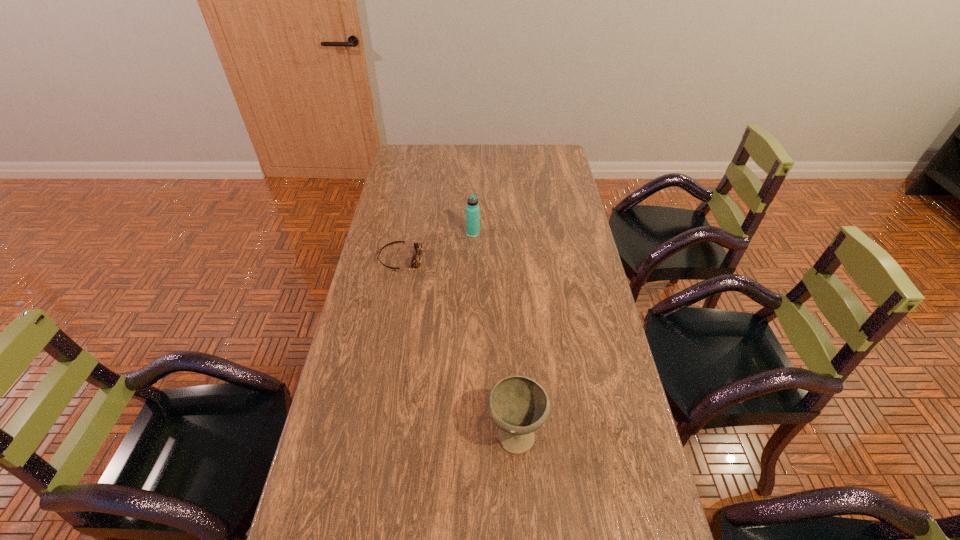
Where is `free space between the goggles and the rightmost object`? The height and width of the screenshot is (540, 960). free space between the goggles and the rightmost object is located at coordinates (458, 346).

The width and height of the screenshot is (960, 540). I want to click on free space between the second farthest object and the nearest object, so click(x=458, y=346).

The height and width of the screenshot is (540, 960). In order to click on free spot between the nearest object and the farthest object in this screenshot , I will do `click(494, 333)`.

At what (x,y) coordinates should I click in order to perform the action: click on vacant area between the nearest object and the leftmost object. Please return your answer as a coordinate pair (x, y). This screenshot has width=960, height=540. Looking at the image, I should click on (458, 346).

Identify the location of blank region between the rightmost object and the farthest object. (494, 333).

Where is `object that stands as the closest to the shortest object`? Image resolution: width=960 pixels, height=540 pixels. object that stands as the closest to the shortest object is located at coordinates (472, 209).

Identify which object is the nearest to the leftmost object. Please provide its 2D coordinates. Your answer should be formatted as a tuple, i.e. [(x, y)], where the tuple contains the x and y coordinates of a point satisfying the conditions above.

[(472, 209)]

I want to click on free space in the image that satisfies the following two spatial constraints: 1. through the lenses of the goggles; 2. on the back side of the nearest object, so click(x=368, y=433).

You are a GUI agent. You are given a task and a screenshot of the screen. Output one action in this format:
    pyautogui.click(x=<x>, y=<y>)
    Task: Click on the blank space that satisfies the following two spatial constraints: 1. through the lenses of the chalice; 2. on the right side of the shortest object
    This screenshot has height=540, width=960.
    Given the screenshot: What is the action you would take?
    pos(368,433)

Where is `blank area in the image that satisfies the following two spatial constraints: 1. on the front side of the second object from left to right; 2. on the right side of the nearest object`? blank area in the image that satisfies the following two spatial constraints: 1. on the front side of the second object from left to right; 2. on the right side of the nearest object is located at coordinates (469, 433).